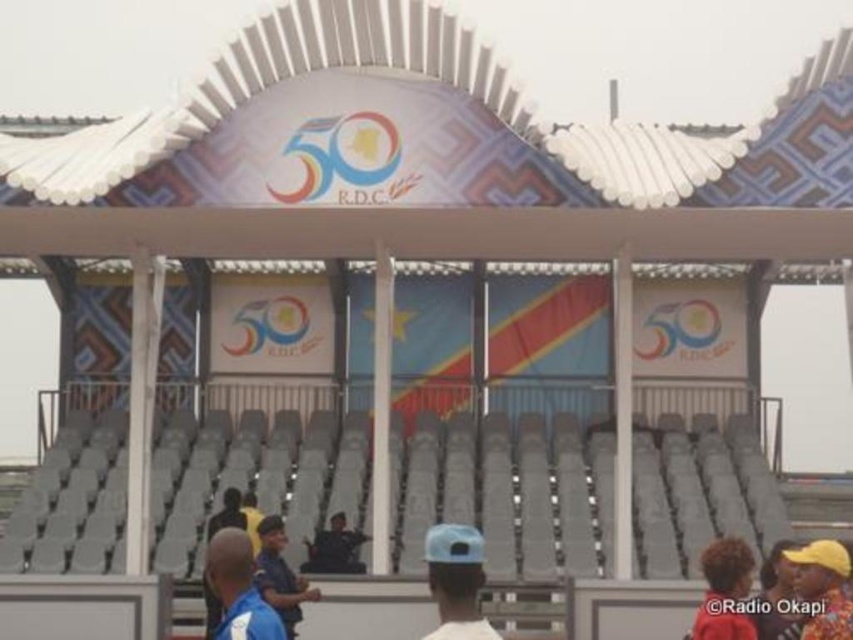
Question: Is blue fabric shirt at lower left positioned behind dark blue fabric jacket at center?

Choices:
 (A) no
 (B) yes

Answer: (A)

Question: Which object appears farthest from the camera in this image?

Choices:
 (A) blue fabric shirt at lower left
 (B) gray plastic seats at lower center
 (C) yellow fabric cap at lower right
 (D) blue matte cap at center

Answer: (B)

Question: Among these points, which one is nearest to the camera?

Choices:
 (A) (809, 593)
 (B) (473, 600)
 (C) (335, 518)
 (D) (242, 636)

Answer: (D)

Question: Observing the image, what is the correct spatial positioning of red fabric person at lower right in reference to yellow fabric hat at upper right?

Choices:
 (A) right
 (B) left

Answer: (B)

Question: Which point is farther to the camera?

Choices:
 (A) blue fabric shirt at center
 (B) dark blue fabric jacket at center
 (C) red fabric person at lower right
 (D) yellow fabric cap at lower right

Answer: (B)

Question: Can you confirm if red fabric person at lower right is positioned above yellow fabric hat at upper right?

Choices:
 (A) yes
 (B) no

Answer: (B)